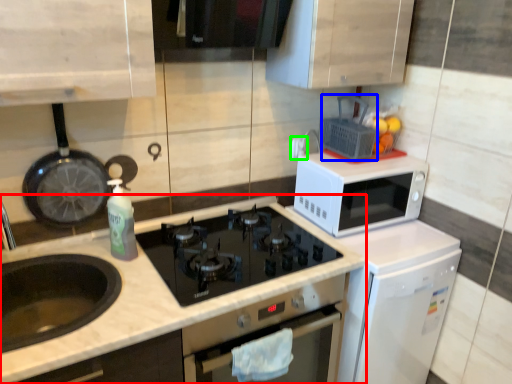
Question: Estimate the real-world distances between objects in this image. Which object is closer to countertop (highlighted by a red box), appliance (highlighted by a blue box) or electric outlet (highlighted by a green box)?

Choices:
 (A) appliance
 (B) electric outlet

Answer: (A)